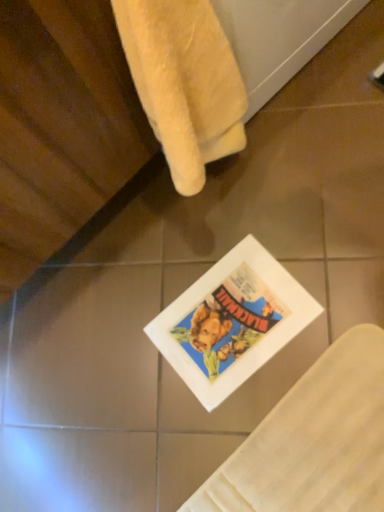
Where is `vacant space underneath matte paper comic book at center (from a real-world perspective)`? This screenshot has height=512, width=384. vacant space underneath matte paper comic book at center (from a real-world perspective) is located at coordinates (243, 307).